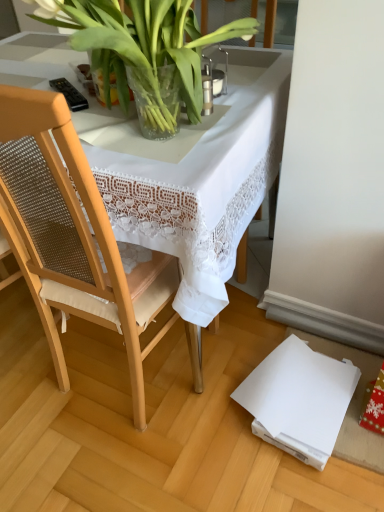
Question: Considering the positions of clear glass vase at upper center and wooden chair at left in the image, is clear glass vase at upper center wider or thinner than wooden chair at left?

Choices:
 (A) thin
 (B) wide

Answer: (A)

Question: Is clear glass vase at upper center taller or shorter than wooden chair at left?

Choices:
 (A) short
 (B) tall

Answer: (A)

Question: Which object is positioned closest to the clear glass vase at upper center?

Choices:
 (A) wooden chair at left
 (B) white lace tablecloth at center

Answer: (B)

Question: Which object is the closest to the clear glass vase at upper center?

Choices:
 (A) white lace tablecloth at center
 (B) wooden chair at left

Answer: (A)